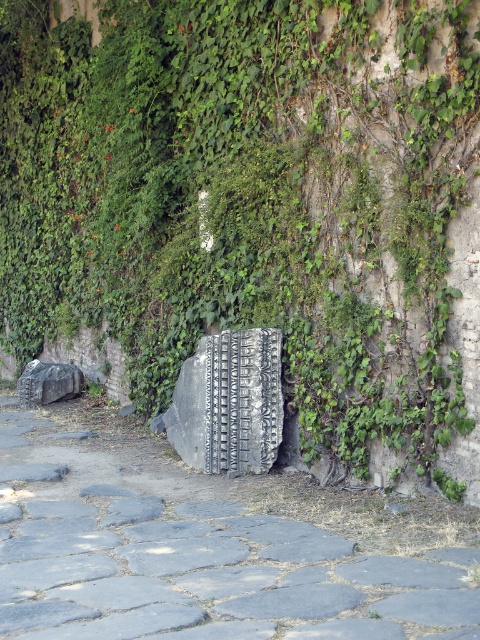
Question: Which point is farther from the camera taking this photo?

Choices:
 (A) (432, 624)
 (B) (240, 442)

Answer: (B)

Question: Does gray stone pavement at center appear over black textured stone at center?

Choices:
 (A) no
 (B) yes

Answer: (A)

Question: Is gray stone pavement at center to the right of black textured stone at center from the viewer's perspective?

Choices:
 (A) yes
 (B) no

Answer: (B)

Question: Can you confirm if gray stone pavement at center is positioned below black textured stone at center?

Choices:
 (A) no
 (B) yes

Answer: (B)